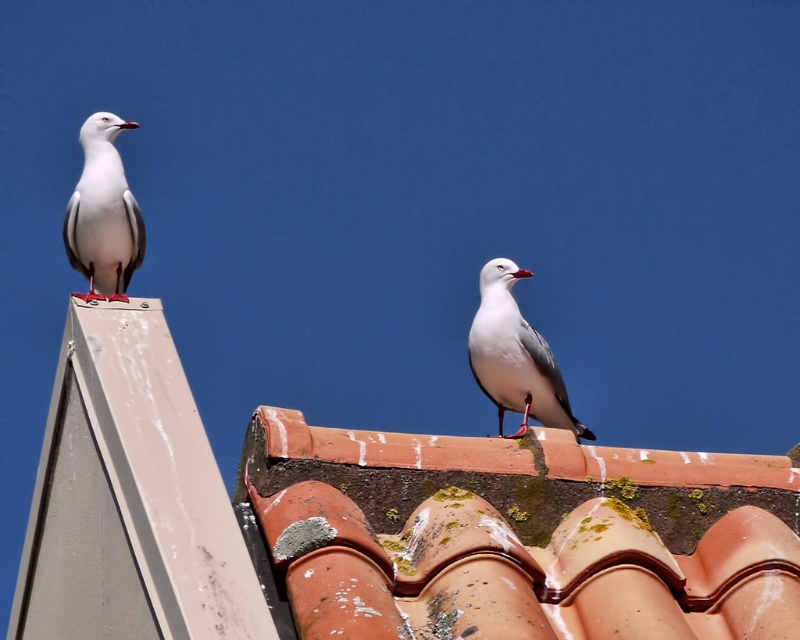
Question: Where is white feathered bird at upper right located in relation to white matte bird at upper left in the image?

Choices:
 (A) right
 (B) left

Answer: (A)

Question: Considering the relative positions of white feathered bird at upper right and white matte bird at upper left in the image provided, where is white feathered bird at upper right located with respect to white matte bird at upper left?

Choices:
 (A) left
 (B) right

Answer: (B)

Question: Among these points, which one is nearest to the camera?

Choices:
 (A) (464, 632)
 (B) (556, 387)
 (C) (80, 198)

Answer: (A)

Question: Which point is closer to the camera?

Choices:
 (A) (512, 557)
 (B) (78, 234)

Answer: (A)

Question: Which point is farther from the camera taking this photo?

Choices:
 (A) (344, 540)
 (B) (513, 300)
 (C) (110, 180)

Answer: (B)

Question: Considering the relative positions of terracotta tiles at upper center and white matte bird at upper left in the image provided, where is terracotta tiles at upper center located with respect to white matte bird at upper left?

Choices:
 (A) right
 (B) left

Answer: (A)